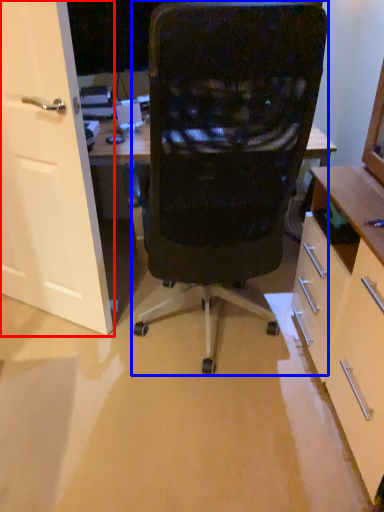
Question: Among these objects, which one is nearest to the camera, door (highlighted by a red box) or chair (highlighted by a blue box)?

Choices:
 (A) door
 (B) chair

Answer: (B)